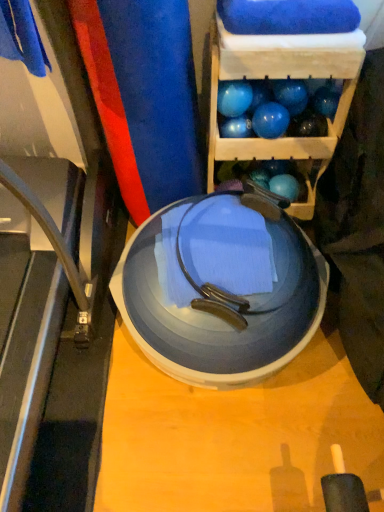
Question: Does point 331,89 appear closer or farther from the camera than point 319,310?

Choices:
 (A) farther
 (B) closer

Answer: (A)

Question: Do you think blue rubber balloon at upper right is within transparent plastic plate at center, or outside of it?

Choices:
 (A) inside
 (B) outside

Answer: (B)

Question: Which object is positioned closest to the transparent plastic plate at center?

Choices:
 (A) metallic gray treadmill at lower left
 (B) blue glossy bowling balls at upper right
 (C) blue rubber balloon at upper right
 (D) blue rubber ball at upper right, which is the 4th ball from right to left
 (E) blue rubber ball at upper right, the fourth ball from the left

Answer: (A)

Question: Considering the real-world distances, which object is farthest from the transparent plastic plate at center?

Choices:
 (A) blue rubber ball at upper right, the fourth ball from the left
 (B) blue rubber ball at upper right, the first ball when ordered from left to right
 (C) blue rubber balloon at upper right
 (D) glossy blue ball at upper center, positioned as the third ball in right-to-left order
 (E) metallic gray treadmill at lower left

Answer: (C)